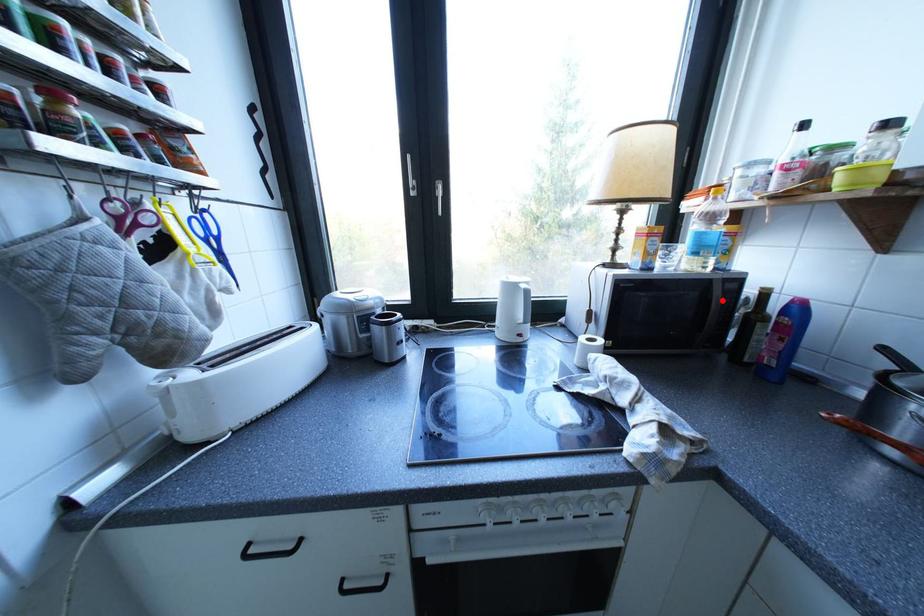
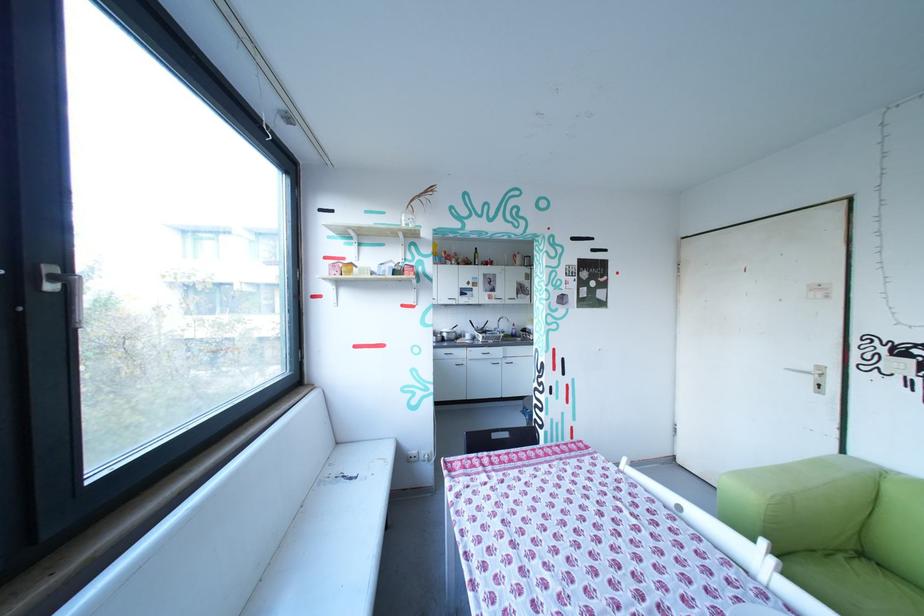
Question: I am providing you with two images of the same scene from different viewpoints. A red point is marked on the first image. Can you still see the location of the red point in image 2?

Choices:
 (A) Yes
 (B) No

Answer: (B)